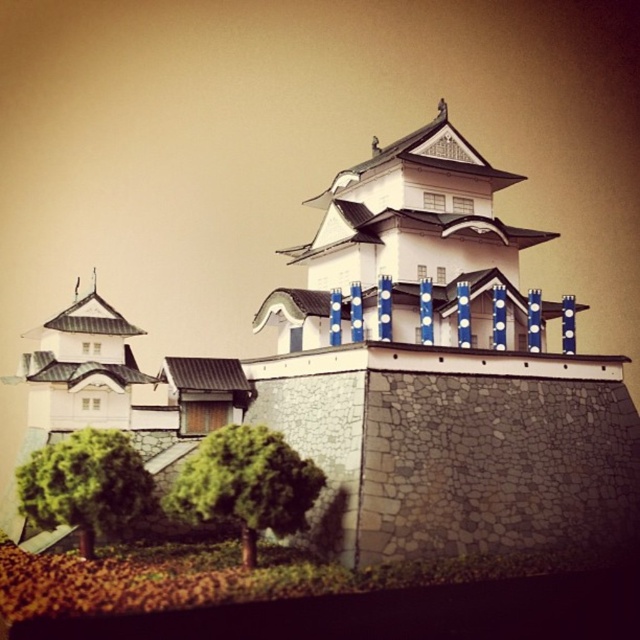
Question: Which of the following is the farthest from the observer?

Choices:
 (A) green leafy tree at lower left
 (B) white stone castle at center

Answer: (B)

Question: Which point is farther from the camera taking this photo?

Choices:
 (A) (68, 472)
 (B) (371, 532)

Answer: (B)

Question: Can you confirm if white stone castle at center is smaller than green leafy tree at lower center?

Choices:
 (A) yes
 (B) no

Answer: (B)

Question: Can you confirm if white stone castle at center is positioned to the right of green leafy tree at lower center?

Choices:
 (A) yes
 (B) no

Answer: (A)

Question: Does white stone castle at center have a larger size compared to green leafy tree at lower center?

Choices:
 (A) yes
 (B) no

Answer: (A)

Question: Which of the following is the farthest from the observer?

Choices:
 (A) (413, 406)
 (B) (237, 476)
 (C) (109, 464)

Answer: (A)